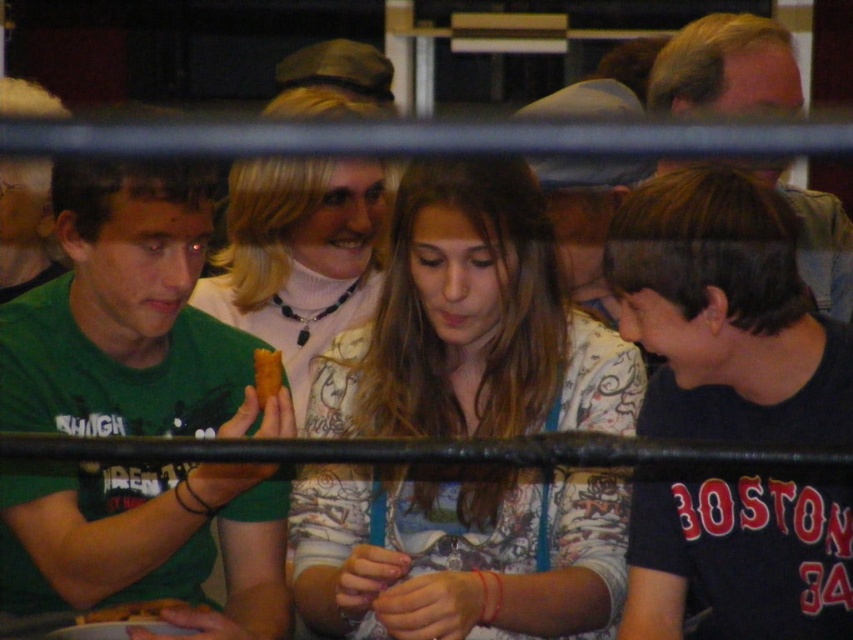
Question: Observing the image, what is the correct spatial positioning of green matte shirt at left in reference to yellow matte bread at center?

Choices:
 (A) right
 (B) left

Answer: (B)

Question: Among these objects, which one is nearest to the camera?

Choices:
 (A) black matte shirt at lower right
 (B) golden crispy pastry at lower left
 (C) green matte shirt at left

Answer: (A)

Question: Does green matte shirt at left have a smaller size compared to white turtleneck sweater at center?

Choices:
 (A) no
 (B) yes

Answer: (B)

Question: Which of the following is the closest to the observer?

Choices:
 (A) (459, 420)
 (B) (292, 252)
 (C) (791, 628)

Answer: (C)

Question: Which point is farther from the camera taking this photo?

Choices:
 (A) (268, 381)
 (B) (293, 163)
 (C) (488, 538)

Answer: (B)

Question: Observing the image, what is the correct spatial positioning of floral-patterned blouse at center in reference to golden crispy pastry at lower left?

Choices:
 (A) right
 (B) left

Answer: (A)